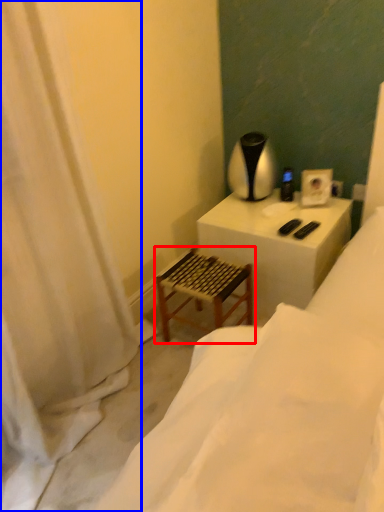
Question: Which object is further to the camera taking this photo, step stool (highlighted by a red box) or curtain (highlighted by a blue box)?

Choices:
 (A) step stool
 (B) curtain

Answer: (A)